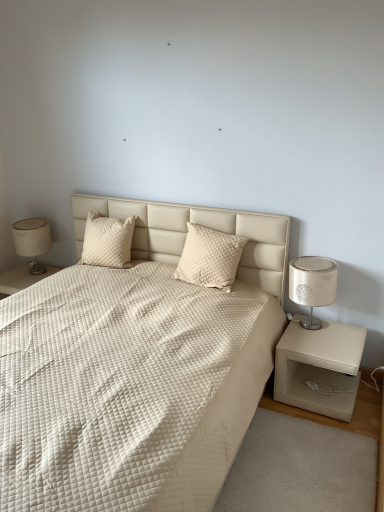
The image size is (384, 512). What do you see at coordinates (209, 257) in the screenshot? I see `cream quilted pillow at center, placed as the 1th pillow when sorted from right to left` at bounding box center [209, 257].

Find the location of a particular element. white leather nightstand at lower left, the 1th nightstand viewed from the left is located at coordinates (21, 278).

The width and height of the screenshot is (384, 512). Describe the element at coordinates (319, 367) in the screenshot. I see `beige leather nightstand at right, the 2th nightstand positioned from the left` at that location.

This screenshot has width=384, height=512. What are the coordinates of `matte beige lampshade at left` in the screenshot? It's located at (32, 241).

This screenshot has width=384, height=512. Describe the element at coordinates (137, 367) in the screenshot. I see `white quilted fabric bed at center` at that location.

Find the location of a particular element. cream quilted pillow at center, which is counted as the 2th pillow, starting from the left is located at coordinates (209, 257).

Considering the relative sizes of white textured lamp at right and white leather nightstand at lower left, the 2th nightstand in the right-to-left sequence, in the image provided, is white textured lamp at right bigger than white leather nightstand at lower left, the 2th nightstand in the right-to-left sequence,?

No, white textured lamp at right is not bigger than white leather nightstand at lower left, the 2th nightstand in the right-to-left sequence.

Is the surface of white textured lamp at right in direct contact with white leather nightstand at lower left, the first nightstand when ordered from back to front?

white textured lamp at right is not next to white leather nightstand at lower left, the first nightstand when ordered from back to front, and they're not touching.

Does point (318, 327) lie behind point (25, 269)?

No, (318, 327) is closer to viewer.

Are cream quilted pillow at center, which is counted as the 2th pillow, starting from the left, and white quilted fabric bed at center located far from each other?

No.

From a real-world perspective, is cream quilted pillow at center, placed as the 1th pillow when sorted from right to left, on white quilted fabric bed at center?

Yes, from a real-world perspective, cream quilted pillow at center, placed as the 1th pillow when sorted from right to left, is on top of white quilted fabric bed at center.

Considering the relative sizes of cream quilted pillow at center, placed as the 1th pillow when sorted from right to left, and white quilted fabric bed at center in the image provided, is cream quilted pillow at center, placed as the 1th pillow when sorted from right to left, shorter than white quilted fabric bed at center?

Yes, cream quilted pillow at center, placed as the 1th pillow when sorted from right to left, is shorter than white quilted fabric bed at center.

Is cream quilted pillow at center, placed as the 1th pillow when sorted from right to left, positioned in front of white quilted fabric bed at center?

No, it is not.

From a real-world perspective, which object rests below the other?

white leather nightstand at lower left, marked as the 2th nightstand in a front-to-back arrangement.

Between point (19, 288) and point (120, 484), which one is positioned in front?

The point (120, 484) is closer to the camera.

Considering the relative sizes of white leather nightstand at lower left, the 1th nightstand viewed from the left, and white quilted fabric bed at center in the image provided, is white leather nightstand at lower left, the 1th nightstand viewed from the left, shorter than white quilted fabric bed at center?

Yes, white leather nightstand at lower left, the 1th nightstand viewed from the left, is shorter than white quilted fabric bed at center.

From the image's perspective, which is above, white quilted fabric bed at center or white leather nightstand at lower left, the 1th nightstand viewed from the left?

white leather nightstand at lower left, the 1th nightstand viewed from the left, appears higher in the image.

Is white quilted fabric bed at center bigger or smaller than white leather nightstand at lower left, arranged as the second nightstand when ordered from the bottom?

Considering their sizes, white quilted fabric bed at center takes up more space than white leather nightstand at lower left, arranged as the second nightstand when ordered from the bottom.

Who is more distant, white quilted fabric bed at center or white leather nightstand at lower left, placed as the 1th nightstand when sorted from top to bottom?

white leather nightstand at lower left, placed as the 1th nightstand when sorted from top to bottom, is further from the camera.

Is point (99, 385) closer to viewer compared to point (110, 256)?

Yes, it is in front of point (110, 256).

Between white quilted fabric bed at center and quilted cream pillow at upper left, the 1th pillow viewed from the left, which one has smaller size?

quilted cream pillow at upper left, the 1th pillow viewed from the left.

Who is taller, white quilted fabric bed at center or quilted cream pillow at upper left, which is the second pillow in right-to-left order?

Standing taller between the two is white quilted fabric bed at center.

Is white leather nightstand at lower left, marked as the 2th nightstand in a front-to-back arrangement, oriented away from quilted cream pillow at upper left, the 1th pillow viewed from the left?

No, white leather nightstand at lower left, marked as the 2th nightstand in a front-to-back arrangement, is not facing away from quilted cream pillow at upper left, the 1th pillow viewed from the left.

From the image's perspective, is white leather nightstand at lower left, placed as the 1th nightstand when sorted from top to bottom, above quilted cream pillow at upper left, which is the second pillow in right-to-left order?

No, from the image's perspective, white leather nightstand at lower left, placed as the 1th nightstand when sorted from top to bottom, is not on top of quilted cream pillow at upper left, which is the second pillow in right-to-left order.

Considering the positions of objects white leather nightstand at lower left, the 2th nightstand in the right-to-left sequence, and quilted cream pillow at upper left, which is the second pillow in right-to-left order, in the image provided, who is more to the left, white leather nightstand at lower left, the 2th nightstand in the right-to-left sequence, or quilted cream pillow at upper left, which is the second pillow in right-to-left order,?

From the viewer's perspective, white leather nightstand at lower left, the 2th nightstand in the right-to-left sequence, appears more on the left side.

From a real-world perspective, who is located higher, white leather nightstand at lower left, the 2th nightstand in the right-to-left sequence, or quilted cream pillow at upper left, which is the second pillow in right-to-left order?

quilted cream pillow at upper left, which is the second pillow in right-to-left order.

Between cream quilted pillow at center, which is counted as the 2th pillow, starting from the left, and quilted cream pillow at upper left, which is the second pillow in right-to-left order, which one appears on the left side from the viewer's perspective?

Positioned to the left is quilted cream pillow at upper left, which is the second pillow in right-to-left order.

Could you tell me if cream quilted pillow at center, placed as the 1th pillow when sorted from right to left, is turned towards quilted cream pillow at upper left, the 1th pillow viewed from the left?

No, cream quilted pillow at center, placed as the 1th pillow when sorted from right to left, is not turned towards quilted cream pillow at upper left, the 1th pillow viewed from the left.

Considering the sizes of objects cream quilted pillow at center, placed as the 1th pillow when sorted from right to left, and quilted cream pillow at upper left, the 1th pillow viewed from the left, in the image provided, who is thinner, cream quilted pillow at center, placed as the 1th pillow when sorted from right to left, or quilted cream pillow at upper left, the 1th pillow viewed from the left,?

Thinner between the two is cream quilted pillow at center, placed as the 1th pillow when sorted from right to left.

Locate an element on the screen. Image resolution: width=384 pixels, height=512 pixels. nightstand behind the white textured lamp at right is located at coordinates (21, 278).

The height and width of the screenshot is (512, 384). Identify the location of pillow located on the right of white quilted fabric bed at center. (209, 257).

When comparing their distances from matte beige lampshade at left, does beige leather nightstand at right, the 2th nightstand from the top, or quilted cream pillow at upper left, which is the second pillow in right-to-left order, seem closer?

quilted cream pillow at upper left, which is the second pillow in right-to-left order, is closer to matte beige lampshade at left.

Considering their positions, is beige leather nightstand at right, the 2th nightstand from the top, positioned closer to white quilted fabric bed at center than cream quilted pillow at center, which is counted as the 2th pillow, starting from the left?

The object closer to white quilted fabric bed at center is cream quilted pillow at center, which is counted as the 2th pillow, starting from the left.

When comparing their distances from white leather nightstand at lower left, the 2th nightstand in the right-to-left sequence, does quilted cream pillow at upper left, the 1th pillow viewed from the left, or beige leather nightstand at right, which appears as the second nightstand when viewed from the back, seem closer?

quilted cream pillow at upper left, the 1th pillow viewed from the left, is positioned closer to the anchor white leather nightstand at lower left, the 2th nightstand in the right-to-left sequence.

Considering their positions, is white leather nightstand at lower left, placed as the 1th nightstand when sorted from top to bottom, positioned further to matte beige lampshade at left than white textured lamp at right?

white textured lamp at right lies further to matte beige lampshade at left than the other object.

In the scene shown: Considering their positions, is beige leather nightstand at right, which appears as the second nightstand when viewed from the back, positioned further to white leather nightstand at lower left, arranged as the second nightstand when ordered from the bottom, than cream quilted pillow at center, which is counted as the 2th pillow, starting from the left?

Among the two, beige leather nightstand at right, which appears as the second nightstand when viewed from the back, is located further to white leather nightstand at lower left, arranged as the second nightstand when ordered from the bottom.

Which object lies further to the anchor point white quilted fabric bed at center, white leather nightstand at lower left, the 2th nightstand in the right-to-left sequence, or beige leather nightstand at right, which appears as the second nightstand when viewed from the back?

white leather nightstand at lower left, the 2th nightstand in the right-to-left sequence, is further to white quilted fabric bed at center.

Based on the photo, from the image, which object appears to be nearer to white textured lamp at right, quilted cream pillow at upper left, the 1th pillow viewed from the left, or matte beige lampshade at left?

quilted cream pillow at upper left, the 1th pillow viewed from the left, lies closer to white textured lamp at right than the other object.

Estimate the real-world distances between objects in this image. Which object is further from white textured lamp at right, quilted cream pillow at upper left, which is the second pillow in right-to-left order, or beige leather nightstand at right, which appears as the second nightstand when viewed from the back?

quilted cream pillow at upper left, which is the second pillow in right-to-left order.

Locate an element on the screen. Image resolution: width=384 pixels, height=512 pixels. bedside lamp between white leather nightstand at lower left, the 2th nightstand in the right-to-left sequence, and beige leather nightstand at right, which is the 1th nightstand from front to back, in the horizontal direction is located at coordinates click(312, 285).

Locate an element on the screen. table lamp located between white leather nightstand at lower left, arranged as the second nightstand when ordered from the bottom, and cream quilted pillow at center, placed as the 1th pillow when sorted from right to left, in the left-right direction is located at coordinates coord(32,241).

Where is `pillow between white leather nightstand at lower left, the 1th nightstand viewed from the left, and cream quilted pillow at center, placed as the 1th pillow when sorted from right to left, in the horizontal direction`? pillow between white leather nightstand at lower left, the 1th nightstand viewed from the left, and cream quilted pillow at center, placed as the 1th pillow when sorted from right to left, in the horizontal direction is located at coordinates (107, 241).

The height and width of the screenshot is (512, 384). What are the coordinates of `pillow between matte beige lampshade at left and cream quilted pillow at center, placed as the 1th pillow when sorted from right to left, in the horizontal direction` in the screenshot? It's located at (107, 241).